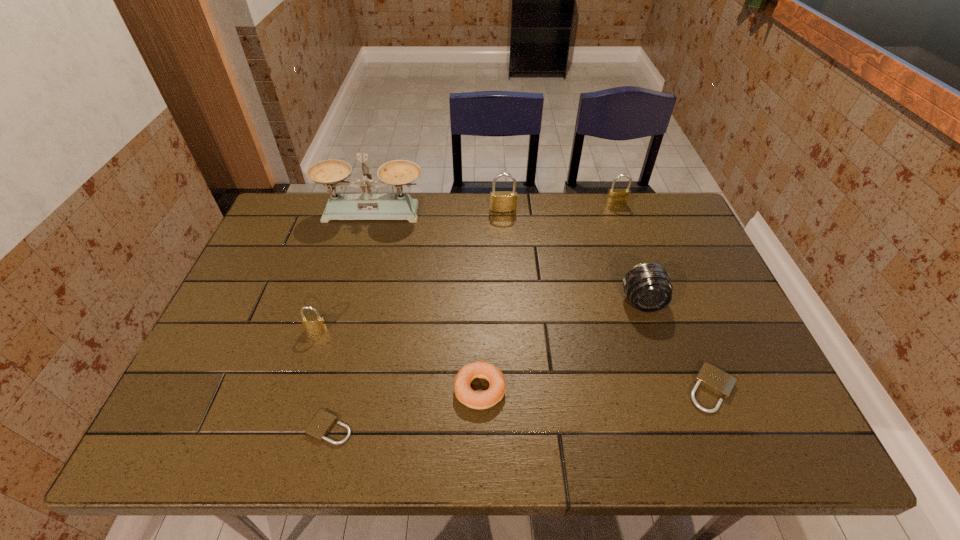
Where is `vacant space at the left edge of the desktop`? vacant space at the left edge of the desktop is located at coordinates (275, 349).

At what (x,y) coordinates should I click in order to perform the action: click on vacant area at the near left corner. Please return your answer as a coordinate pair (x, y). This screenshot has width=960, height=540. Looking at the image, I should click on (181, 428).

The height and width of the screenshot is (540, 960). In the image, there is a desktop. Find the location of `free region at the far right corner`. free region at the far right corner is located at coordinates (661, 198).

Find the location of a particular element. The height and width of the screenshot is (540, 960). vacant space that is in between the bagel and the scale is located at coordinates (426, 300).

In order to click on free space between the second tallest padlock and the smaller beige padlock in this screenshot , I will do `click(473, 316)`.

I want to click on vacant point located between the tallest object and the telephoto lens, so click(x=508, y=257).

I want to click on vacant space that is in between the fourth shortest padlock and the fifth nearest object, so click(x=629, y=253).

At what (x,y) coordinates should I click in order to perform the action: click on free point between the leftmost brass padlock and the right beige padlock. Please return your answer as a coordinate pair (x, y). The image size is (960, 540). Looking at the image, I should click on click(514, 359).

This screenshot has height=540, width=960. I want to click on unoccupied area between the telephoto lens and the rightmost brass padlock, so click(x=629, y=253).

In order to click on free space between the bigger beige padlock and the shortest object in this screenshot , I will do `click(520, 408)`.